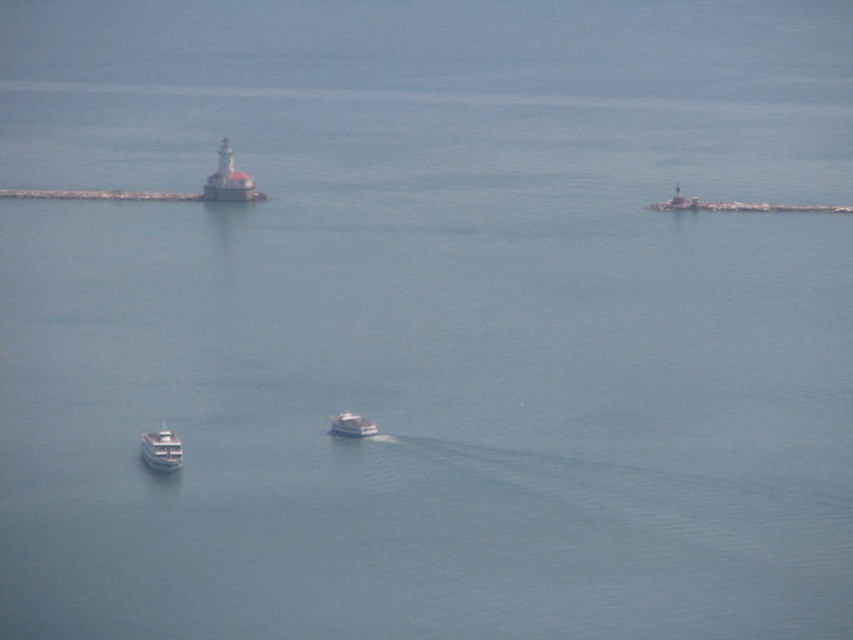
You are a sailor on the white glossy boat at lower left. You want to signal the white glossy boat at center using a flag. Since both boats are moving, you need to know which boat is taller to determine the best way to communicate. Which boat is taller?

The white glossy boat at lower left has a greater height compared to the white glossy boat at center, so the white glossy boat at lower left is taller.

You are navigating a boat and need to determine your position relative to the white glossy lighthouse at upper center. According to the coordinates provided, where exactly is the lighthouse positioned?

The white glossy lighthouse at upper center is located at coordinates point (229, 180).

You are a sailor navigating a narrow channel between two rocky outcrops. You see the white glossy boat at lower left and the white glossy boat at center. Which boat is positioned closer to the lighthouse on the left?

The white glossy boat at lower left is closer to the lighthouse on the left because it is located below the white glossy boat at center, which is further away from the lighthouse.